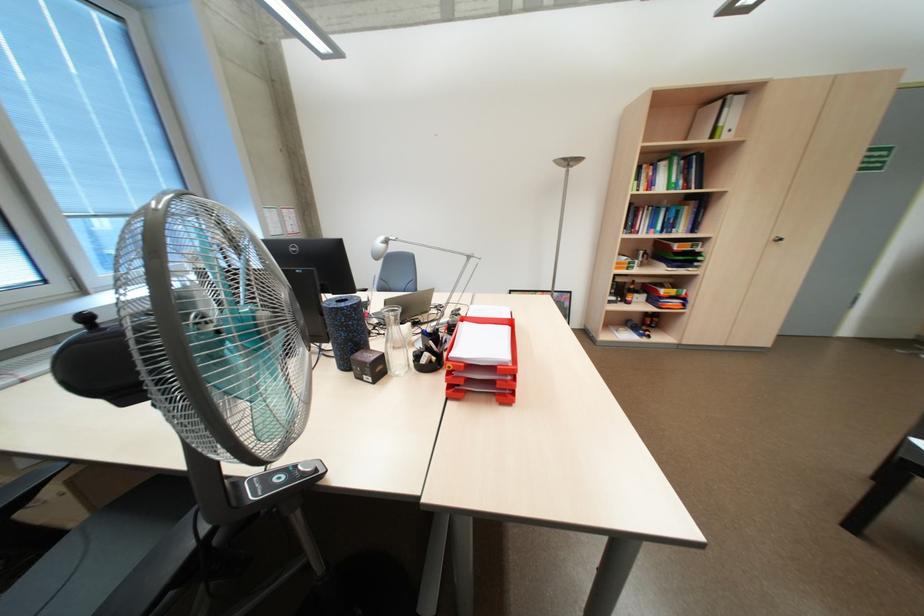
Find where to pull the red paper tray. Please return your answer as a coordinate pair (x, y).

(492, 357)